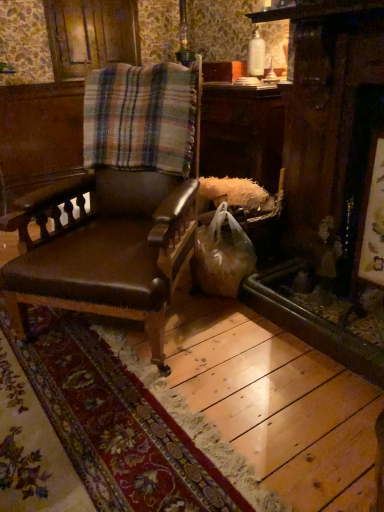
You are a GUI agent. You are given a task and a screenshot of the screen. Output one action in this format:
    pyautogui.click(x=<x>, y=<y>)
    Task: Click on the free spot below matte brown leather chair at center (from a real-world perspective)
    Image resolution: width=384 pixels, height=512 pixels.
    Given the screenshot: What is the action you would take?
    pyautogui.click(x=138, y=324)